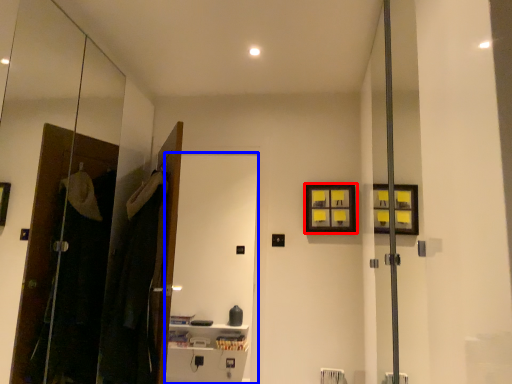
Question: Which point is further to the camera, picture frame (highlighted by a red box) or screen door (highlighted by a blue box)?

Choices:
 (A) picture frame
 (B) screen door

Answer: (A)